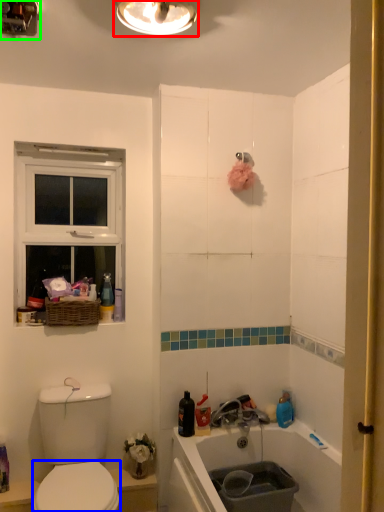
Question: Which object is the closest to the light fixture (highlighted by a red box)? Choose among these: bidet (highlighted by a blue box) or light fixture (highlighted by a green box).

Choices:
 (A) bidet
 (B) light fixture

Answer: (B)